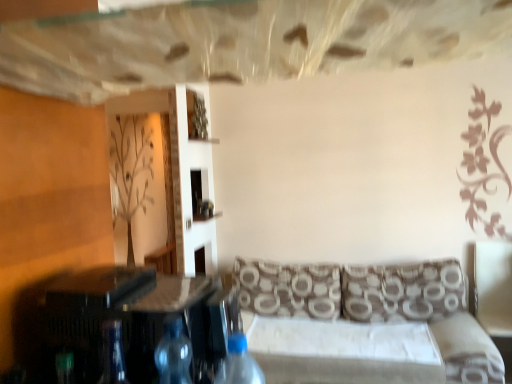
Question: In the image, is white leather swivel chair at right positioned in front of or behind transparent plastic bottle at center, which is the 2th bottle from right to left?

Choices:
 (A) front
 (B) behind

Answer: (B)

Question: From the image's perspective, relative to transparent plastic bottle at center, arranged as the 1th bottle when viewed from the left, is white leather swivel chair at right above or below?

Choices:
 (A) above
 (B) below

Answer: (B)

Question: Which is farther from the brown patterned fabric couch at center?

Choices:
 (A) transparent plastic bottle at center, arranged as the 1th bottle when viewed from the left
 (B) brown printed cushion at center, the second pillow viewed from the right
 (C) blue translucent bottle at lower center, which is the second bottle in left-to-right order
 (D) transparent glass table at center
 (E) brown printed cushion at right, placed as the second pillow when sorted from left to right

Answer: (A)

Question: Based on their relative distances, which object is farther from the white leather swivel chair at right?

Choices:
 (A) transparent plastic bottle at center, which is the 2th bottle from right to left
 (B) brown patterned fabric couch at center
 (C) brown printed cushion at center, the second pillow viewed from the right
 (D) brown printed cushion at right, placed as the second pillow when sorted from left to right
 (E) transparent glass table at center

Answer: (A)